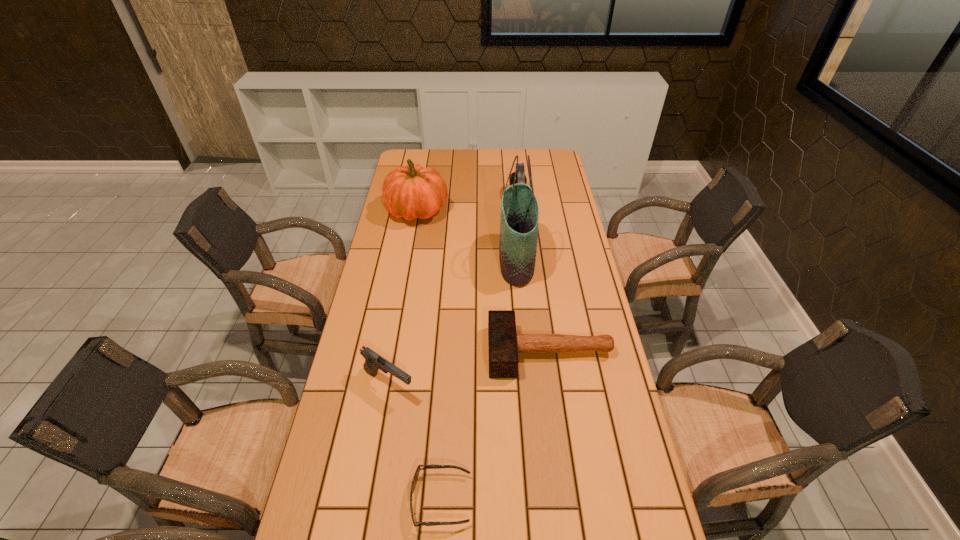
At what (x,y) coordinates should I click in order to perform the action: click on free space located 0.400m on the ear cups of the earphone. Please return your answer as a coordinate pair (x, y). Looking at the image, I should click on (418, 198).

In order to click on vacant space located on the ear cups of the earphone in this screenshot , I will do `click(452, 198)`.

Where is `vacant space located 0.250m on the ear cups of the earphone`? This screenshot has width=960, height=540. vacant space located 0.250m on the ear cups of the earphone is located at coordinates (452, 198).

This screenshot has height=540, width=960. In order to click on vacant area situated 0.160m at the muzzle of the gun in this screenshot , I will do `click(473, 384)`.

The height and width of the screenshot is (540, 960). I want to click on vacant space located 0.370m on the hammer head face of the mallet, so click(367, 352).

I want to click on vacant position located on the hammer head face of the mallet, so tap(356, 352).

Find the location of `vacant region located 0.340m on the hammer head face of the mallet`. vacant region located 0.340m on the hammer head face of the mallet is located at coordinates (376, 352).

The width and height of the screenshot is (960, 540). I want to click on vacant space located 0.390m on the front-facing side of the nearest object, so click(637, 500).

This screenshot has width=960, height=540. I want to click on pumpkin located at the left edge, so click(412, 191).

Locate an element on the screen. The image size is (960, 540). gun that is at the left edge is located at coordinates (373, 362).